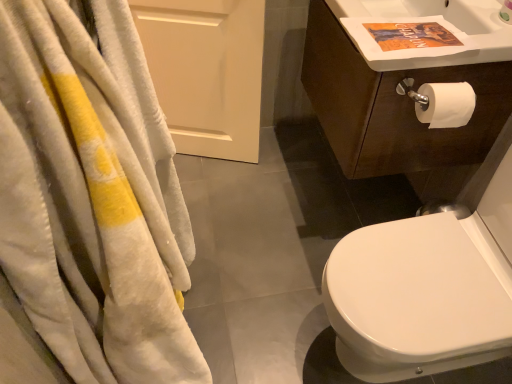
Find the location of a particular element. Image resolution: width=512 pixels, height=384 pixels. white glossy sink at upper right is located at coordinates (428, 21).

Locate an element on the screen. This screenshot has width=512, height=384. dark brown wood cabinet at upper right is located at coordinates (402, 96).

This screenshot has height=384, width=512. What do you see at coordinates (418, 298) in the screenshot? I see `white glossy bidet at right` at bounding box center [418, 298].

The width and height of the screenshot is (512, 384). In order to click on white glossy bidet at right in this screenshot , I will do `click(418, 298)`.

The image size is (512, 384). I want to click on white matte door at upper left, so click(206, 72).

What do you see at coordinates (206, 72) in the screenshot? The image size is (512, 384). I see `white matte door at upper left` at bounding box center [206, 72].

You are a GUI agent. You are given a task and a screenshot of the screen. Output one action in this format:
    pyautogui.click(x=<x>, y=<y>)
    Task: Click on the white soft towel at left
    The height and width of the screenshot is (384, 512).
    Given the screenshot: What is the action you would take?
    pyautogui.click(x=88, y=204)

Locate an element on the screen. This screenshot has height=384, width=512. bathroom cabinet below the white soft towel at left (from a real-world perspective) is located at coordinates (402, 96).

Is white soft towel at left inside dark brown wood cabinet at upper right?

No, white soft towel at left is located outside of dark brown wood cabinet at upper right.

Which is in front, dark brown wood cabinet at upper right or white soft towel at left?

white soft towel at left is more forward.

Is white glossy bidet at right located within white glossy sink at upper right?

Definitely not — white glossy bidet at right is not inside white glossy sink at upper right.

From the image's perspective, is white glossy sink at upper right located above or below white glossy bidet at right?

Clearly, from the image's perspective, white glossy sink at upper right is above white glossy bidet at right.

Which is more to the right, white glossy sink at upper right or white glossy bidet at right?

white glossy bidet at right is more to the right.

Considering the positions of objects white matte door at upper left and white soft towel at left in the image provided, who is in front, white matte door at upper left or white soft towel at left?

white soft towel at left is in front.

Can you confirm if white matte door at upper left is positioned to the right of white soft towel at left?

Incorrect, white matte door at upper left is not on the right side of white soft towel at left.

From the picture: From the image's perspective, which is below, dark brown wood cabinet at upper right or white glossy sink at upper right?

From the image's view, white glossy sink at upper right is below.

Considering the relative sizes of dark brown wood cabinet at upper right and white glossy sink at upper right in the image provided, is dark brown wood cabinet at upper right bigger than white glossy sink at upper right?

Correct, dark brown wood cabinet at upper right is larger in size than white glossy sink at upper right.

Does dark brown wood cabinet at upper right contain white glossy sink at upper right?

Actually, white glossy sink at upper right is outside dark brown wood cabinet at upper right.

Would you say dark brown wood cabinet at upper right is a long distance from white glossy sink at upper right?

No.

From a real-world perspective, is white soft towel at left physically above white glossy bidet at right?

Yes, from a real-world perspective, white soft towel at left is over white glossy bidet at right

Is white soft towel at left positioned with its back to white glossy bidet at right?

No, white soft towel at left is not facing away from white glossy bidet at right.

Does white soft towel at left have a larger size compared to white glossy bidet at right?

No, white soft towel at left is not bigger than white glossy bidet at right.

Which point is more forward, (122, 123) or (369, 258)?

The point (122, 123) is in front.

Could you tell me if dark brown wood cabinet at upper right is facing white glossy bidet at right?

No, dark brown wood cabinet at upper right does not turn towards white glossy bidet at right.

From a real-world perspective, does dark brown wood cabinet at upper right sit lower than white glossy bidet at right?

Incorrect, from a real-world perspective, dark brown wood cabinet at upper right is higher than white glossy bidet at right.

Locate an element on the screen. The width and height of the screenshot is (512, 384). bathroom cabinet on the left side of white glossy bidet at right is located at coordinates (402, 96).

Considering the sizes of dark brown wood cabinet at upper right and white glossy bidet at right in the image, is dark brown wood cabinet at upper right taller or shorter than white glossy bidet at right?

Considering their sizes, dark brown wood cabinet at upper right has less height than white glossy bidet at right.

Which of these two, white matte door at upper left or white glossy bidet at right, is wider?

Wider between the two is white glossy bidet at right.

Considering the positions of point (254, 27) and point (500, 302), is point (254, 27) closer or farther from the camera than point (500, 302)?

Point (254, 27).

From the image's perspective, does white matte door at upper left appear higher than white glossy bidet at right?

Indeed, from the image's perspective, white matte door at upper left is shown above white glossy bidet at right.

Is white matte door at upper left taller than white glossy bidet at right?

No.

Locate an element on the screen. The width and height of the screenshot is (512, 384). towel to the left of dark brown wood cabinet at upper right is located at coordinates (88, 204).

Locate an element on the screen. This screenshot has width=512, height=384. bidet below the white glossy sink at upper right (from a real-world perspective) is located at coordinates (418, 298).

Based on their spatial positions, is white matte door at upper left or dark brown wood cabinet at upper right further from white soft towel at left?

Among the two, white matte door at upper left is located further to white soft towel at left.

Estimate the real-world distances between objects in this image. Which object is further from white soft towel at left, dark brown wood cabinet at upper right or white glossy bidet at right?

dark brown wood cabinet at upper right is further to white soft towel at left.

Based on their spatial positions, is white matte door at upper left or white glossy bidet at right further from dark brown wood cabinet at upper right?

Based on the image, white matte door at upper left appears to be further to dark brown wood cabinet at upper right.

Which object lies nearer to the anchor point white glossy sink at upper right, white soft towel at left or dark brown wood cabinet at upper right?

dark brown wood cabinet at upper right lies closer to white glossy sink at upper right than the other object.

From the image, which object appears to be nearer to white soft towel at left, dark brown wood cabinet at upper right or white matte door at upper left?

dark brown wood cabinet at upper right is positioned closer to the anchor white soft towel at left.

Looking at the image, which one is located closer to white matte door at upper left, dark brown wood cabinet at upper right or white soft towel at left?

dark brown wood cabinet at upper right is closer to white matte door at upper left.

When comparing their distances from white glossy sink at upper right, does white glossy bidet at right or white soft towel at left seem closer?

white glossy bidet at right lies closer to white glossy sink at upper right than the other object.

Based on their spatial positions, is white soft towel at left or white glossy bidet at right further from dark brown wood cabinet at upper right?

white soft towel at left.

Image resolution: width=512 pixels, height=384 pixels. In order to click on bidet between white soft towel at left and white matte door at upper left from front to back in this screenshot , I will do `click(418, 298)`.

The height and width of the screenshot is (384, 512). I want to click on sink between white glossy bidet at right and white matte door at upper left along the z-axis, so click(x=428, y=21).

Find the location of a particular element. The height and width of the screenshot is (384, 512). bathroom cabinet situated between white matte door at upper left and white glossy bidet at right from left to right is located at coordinates (402, 96).

Locate an element on the screen. The height and width of the screenshot is (384, 512). sink between white soft towel at left and white matte door at upper left from front to back is located at coordinates (428, 21).